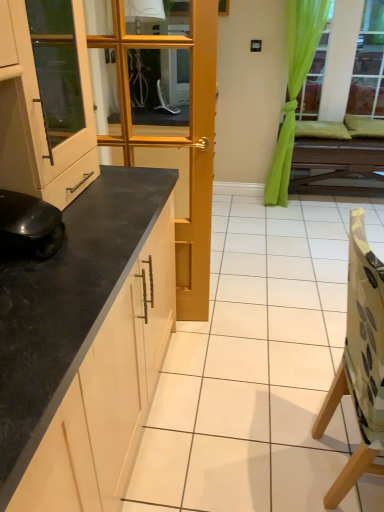
Question: Is black matte robot vacuum cleaner at lower left inside the boundaries of matte white cabinet at left, or outside?

Choices:
 (A) outside
 (B) inside

Answer: (A)

Question: In terms of width, does black matte robot vacuum cleaner at lower left look wider or thinner when compared to matte white cabinet at left?

Choices:
 (A) wide
 (B) thin

Answer: (B)

Question: Based on their relative distances, which object is nearer to the black granite countertop at left?

Choices:
 (A) green fabric curtain at upper right
 (B) camouflage fabric chair at right
 (C) wooden door at center
 (D) black matte robot vacuum cleaner at lower left
 (E) wooden table at center

Answer: (D)

Question: Based on their relative distances, which object is nearer to the camouflage fabric chair at right?

Choices:
 (A) green fabric curtain at upper right
 (B) black matte robot vacuum cleaner at lower left
 (C) wooden table at center
 (D) matte white cabinet at left
 (E) wooden door at center

Answer: (B)